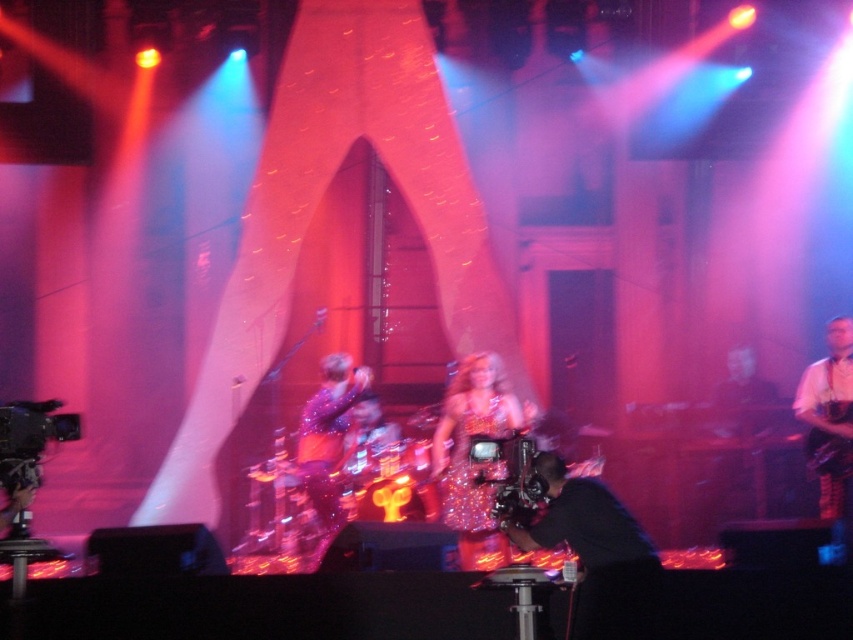
Can you confirm if sparkly gold dress at center is wider than sparkly purple dress at center?

Correct, the width of sparkly gold dress at center exceeds that of sparkly purple dress at center.

Where is `sparkly gold dress at center`? sparkly gold dress at center is located at coordinates (467, 456).

What are the coordinates of `sparkly gold dress at center` in the screenshot? It's located at (467, 456).

Does black matte camera at center have a larger size compared to black glossy guitar at center?

Incorrect, black matte camera at center is not larger than black glossy guitar at center.

Who is lower down, black matte camera at center or black glossy guitar at center?

black matte camera at center is below.

Does point (592, 480) lie in front of point (740, 364)?

Yes, point (592, 480) is closer to viewer.

Find the location of a particular element. This screenshot has height=640, width=853. black matte camera at center is located at coordinates (596, 554).

Does white leather guitar at right have a lesser height compared to sparkly purple dress at center?

No, white leather guitar at right is not shorter than sparkly purple dress at center.

Who is positioned more to the left, white leather guitar at right or sparkly purple dress at center?

Positioned to the left is sparkly purple dress at center.

Identify the location of white leather guitar at right. (830, 420).